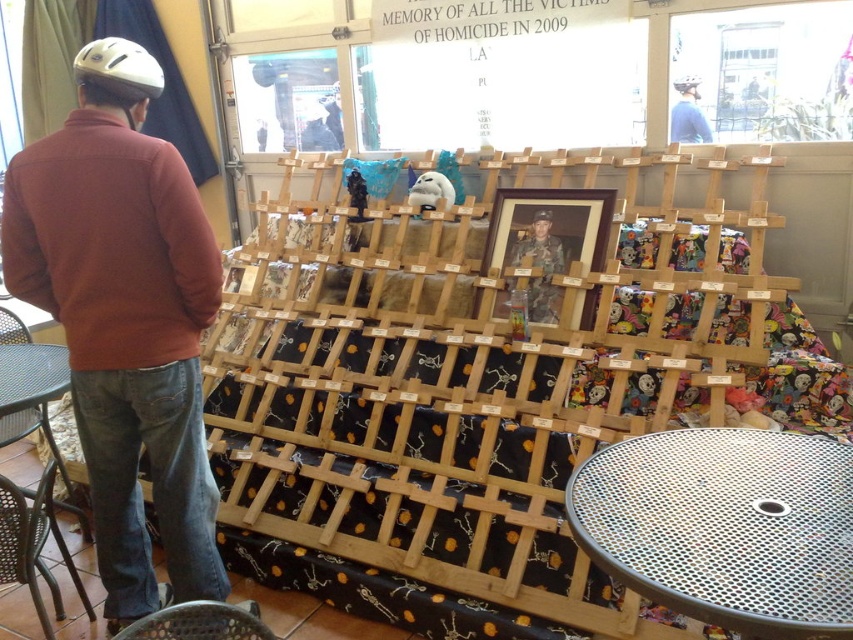
You are planning to sit on the metal mesh chair at lower left while holding the camouflage uniform at center. Considering their sizes, do you think the chair can support your weight?

The metal mesh chair at lower left has a smaller size compared to camouflage uniform at center. Since the chair is smaller, it may not be able to support your weight comfortably or safely. It is advisable to choose a larger or more sturdy chair for this purpose.

You are standing in front of the display and want to reach both the point at coordinates point (x=614, y=195) and point (x=15, y=404). Which point will you reach first?

You will reach point (x=614, y=195) first because it is closer to you than point (x=15, y=404), which is further away.